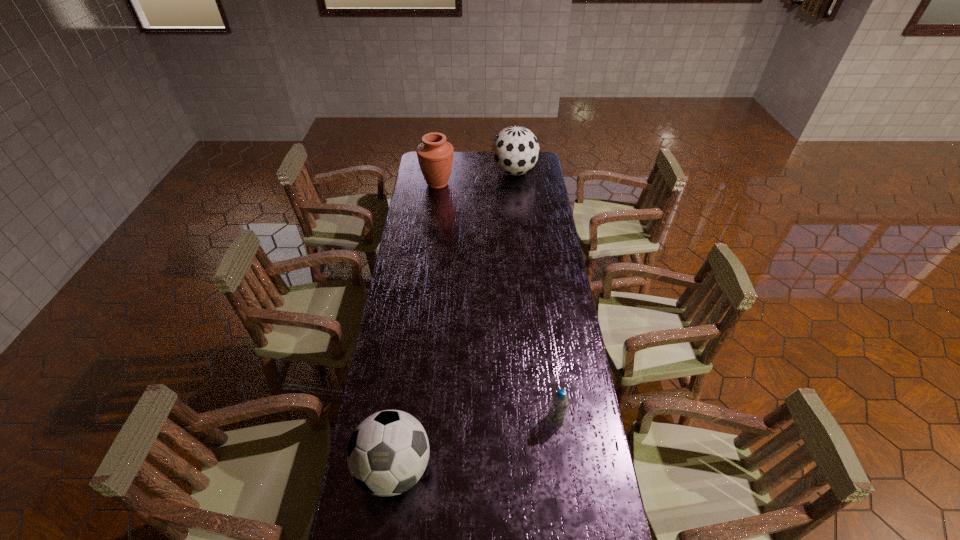
Image resolution: width=960 pixels, height=540 pixels. In order to click on vase in this screenshot , I will do `click(435, 155)`.

Where is `the farther soccer ball`? Image resolution: width=960 pixels, height=540 pixels. the farther soccer ball is located at coordinates (515, 150).

This screenshot has width=960, height=540. I want to click on the second shortest object, so click(x=387, y=454).

Where is `the nearest object`? This screenshot has height=540, width=960. the nearest object is located at coordinates [387, 454].

Where is `the third farthest object`? the third farthest object is located at coordinates (560, 401).

This screenshot has width=960, height=540. What are the coordinates of `water bottle` in the screenshot? It's located at (560, 401).

Where is `free space located on the right of the vase`? free space located on the right of the vase is located at coordinates (515, 184).

At what (x,y) coordinates should I click in order to perform the action: click on vacant space located on the front of the right soccer ball. Please return your answer as a coordinate pair (x, y). Image resolution: width=960 pixels, height=540 pixels. Looking at the image, I should click on (519, 222).

The width and height of the screenshot is (960, 540). I want to click on vacant space located on the main logo of the second shortest object, so click(x=386, y=533).

Where is `free space located on the back of the second nearest object`? free space located on the back of the second nearest object is located at coordinates (547, 346).